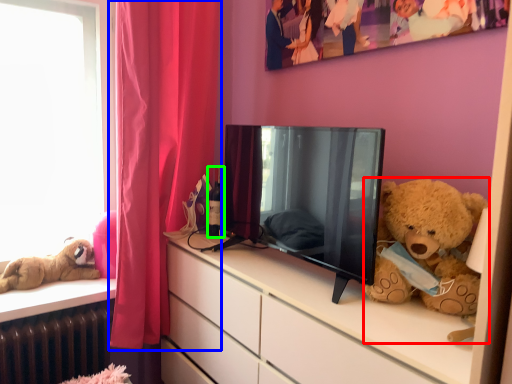
Question: Based on their relative distances, which object is farther from teddy bear (highlighted by a red box)? Choose from curtain (highlighted by a blue box) and bottle (highlighted by a green box).

Choices:
 (A) curtain
 (B) bottle

Answer: (A)